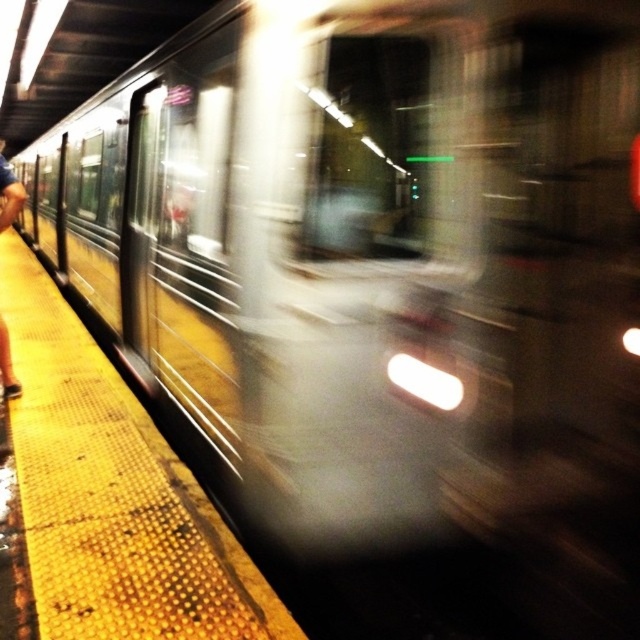
You are standing on the subway platform and notice both the yellow textured platform at left and the blue jeans at left. Which object is nearer to you?

The yellow textured platform at left is closer to the viewer than the blue jeans at left, so the yellow textured platform at left is nearer to you.

You are a passenger waiting at the subway station and notice both the yellow textured platform at left and the blue jeans at left. Which object is located to the right when facing the platform?

The yellow textured platform at left is positioned on the right side of blue jeans at left, so when facing the platform, the yellow textured platform at left is to the right of the blue jeans at left.